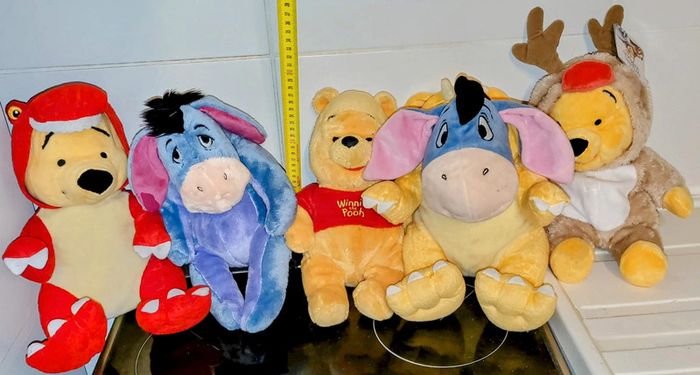
Locate an element on the screen. The height and width of the screenshot is (375, 700). stuffed animals is located at coordinates (596, 129), (472, 154), (344, 162), (186, 169), (74, 167).